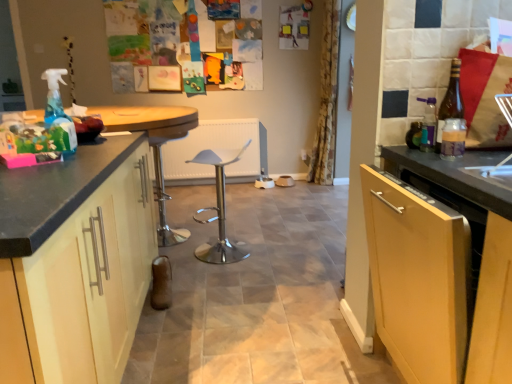
Question: Considering the positions of polished silver bar stool at center, positioned as the 1th bar stool in right-to-left order, and matte black cabinet at left in the image, is polished silver bar stool at center, positioned as the 1th bar stool in right-to-left order, taller or shorter than matte black cabinet at left?

Choices:
 (A) short
 (B) tall

Answer: (A)

Question: Considering the positions of polished silver bar stool at center, positioned as the 1th bar stool in right-to-left order, and matte black cabinet at left in the image, is polished silver bar stool at center, positioned as the 1th bar stool in right-to-left order, wider or thinner than matte black cabinet at left?

Choices:
 (A) wide
 (B) thin

Answer: (B)

Question: Estimate the real-world distances between objects in this image. Which object is farther from the polished chrome bar stool at center, placed as the 2th bar stool when sorted from right to left?

Choices:
 (A) brown glass bottle at right, the 1th bottle in the back-to-front sequence
 (B) black granite countertop at left
 (C) polished silver bar stool at center, acting as the 2th bar stool starting from the left
 (D) yellow floral fabric curtain at center
 (E) matte black cabinet at left

Answer: (D)

Question: Based on their relative distances, which object is nearer to the polished chrome bar stool at center, placed as the 2th bar stool when sorted from right to left?

Choices:
 (A) black granite countertop at left
 (B) brown glass bottle at right, the 1th bottle in the back-to-front sequence
 (C) translucent plastic bottle at right, which ranks as the 2th bottle in back-to-front order
 (D) matte black cabinet at left
 (E) yellow floral fabric curtain at center

Answer: (A)